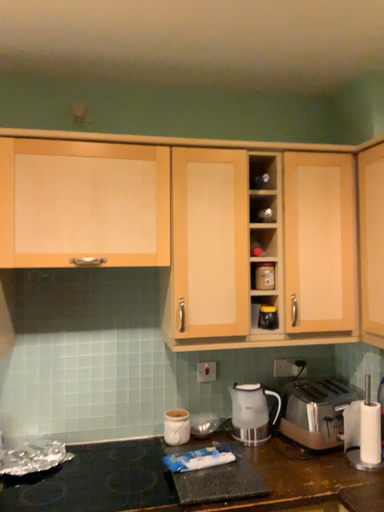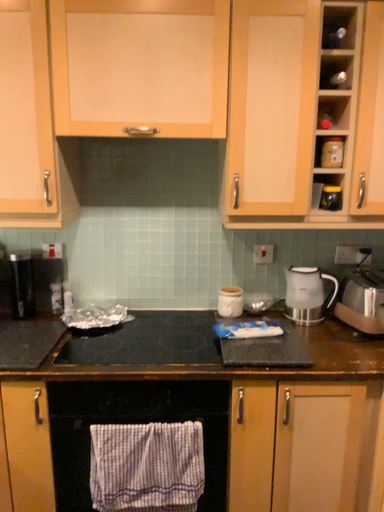
Question: How did the camera likely rotate when shooting the video?

Choices:
 (A) rotated right
 (B) rotated left

Answer: (B)